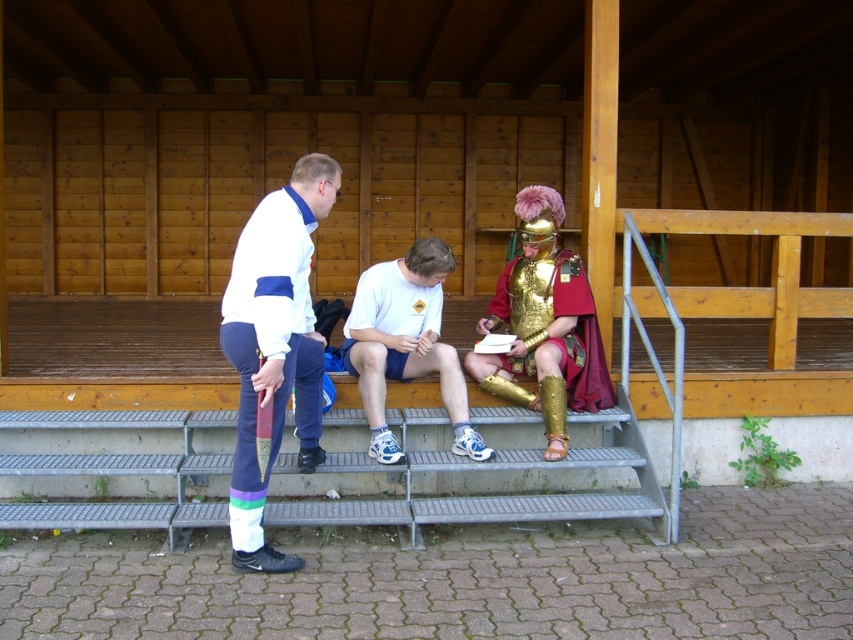
Which is below, metallic gray stairs at lower center or white matte shorts at center?

metallic gray stairs at lower center is lower down.

Is metallic gray stairs at lower center smaller than white matte shorts at center?

No.

In order to click on metallic gray stairs at lower center in this screenshot , I will do `click(503, 493)`.

Between white fabric jacket at center and gold plated armor at center, which one has less height?

Standing shorter between the two is gold plated armor at center.

Is point (263, 225) positioned after point (602, 356)?

No.

Describe the element at coordinates (274, 346) in the screenshot. This screenshot has height=640, width=853. I see `white fabric jacket at center` at that location.

Identify the location of white fabric jacket at center. click(x=274, y=346).

Is metallic gray stairs at lower center closer to camera compared to gold plated armor at center?

Yes, it is.

Who is shorter, metallic gray stairs at lower center or gold plated armor at center?

With less height is metallic gray stairs at lower center.

Is point (16, 413) positioned before point (578, 298)?

Yes, it is.

At what (x,y) coordinates should I click in order to perform the action: click on metallic gray stairs at lower center. Please return your answer as a coordinate pair (x, y). Looking at the image, I should click on (503, 493).